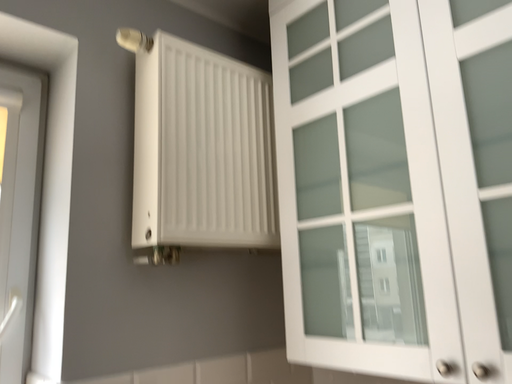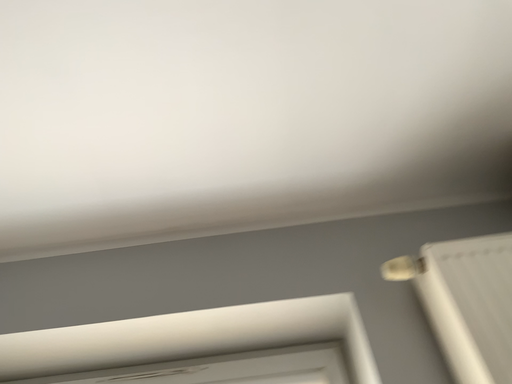
Question: Which way did the camera rotate in the video?

Choices:
 (A) rotated right
 (B) rotated left

Answer: (B)